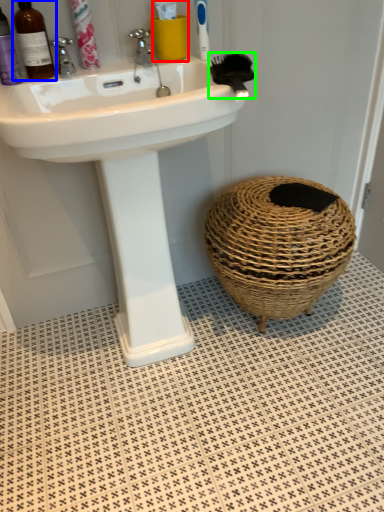
Question: Considering the real-world distances, which object is farthest from toiletry (highlighted by a red box)? mouthwash (highlighted by a blue box) or brush (highlighted by a green box)?

Choices:
 (A) mouthwash
 (B) brush

Answer: (A)